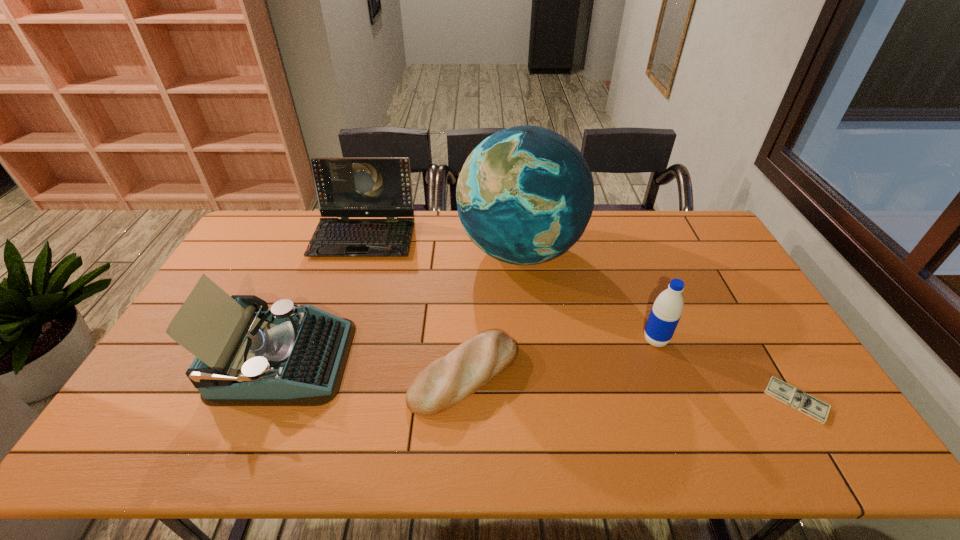
You are a GUI agent. You are given a task and a screenshot of the screen. Output one action in this format:
    pyautogui.click(x=<x>, y=<y>)
    Task: Click on the vacant space in between the laptop computer and the globe
    
    Given the screenshot: What is the action you would take?
    pyautogui.click(x=442, y=243)

Where is `free space that is in between the globe and the laptop computer`? free space that is in between the globe and the laptop computer is located at coordinates (442, 243).

In order to click on the fifth closest object to the dollar in this screenshot , I will do `click(346, 187)`.

Choose which object is the fifth nearest neighbor to the shortest object. Please provide its 2D coordinates. Your answer should be formatted as a tuple, i.e. [(x, y)], where the tuple contains the x and y coordinates of a point satisfying the conditions above.

[(346, 187)]

In order to click on vacant space that satisfies the following two spatial constraints: 1. on the back side of the tallest object; 2. on the left side of the bread in this screenshot , I will do `click(468, 251)`.

Locate an element on the screen. This screenshot has height=540, width=960. free spot that satisfies the following two spatial constraints: 1. on the front side of the tallest object; 2. on the typing side of the typewriter is located at coordinates (532, 360).

Find the location of `vacant area in the image that satisfies the following two spatial constraints: 1. on the typing side of the typewriter; 2. on the left side of the bread`. vacant area in the image that satisfies the following two spatial constraints: 1. on the typing side of the typewriter; 2. on the left side of the bread is located at coordinates (277, 374).

The width and height of the screenshot is (960, 540). I want to click on free space that satisfies the following two spatial constraints: 1. on the screen of the laptop computer; 2. on the right side of the fifth tallest object, so click(x=319, y=374).

At what (x,y) coordinates should I click in order to perform the action: click on free spot that satisfies the following two spatial constraints: 1. on the screen of the laptop computer; 2. on the typing side of the typewriter. Please return your answer as a coordinate pair (x, y). This screenshot has width=960, height=540. Looking at the image, I should click on (324, 360).

Where is `vacant space that satisfies the following two spatial constraints: 1. on the front side of the bread; 2. on the left side of the shortest object`? Image resolution: width=960 pixels, height=540 pixels. vacant space that satisfies the following two spatial constraints: 1. on the front side of the bread; 2. on the left side of the shortest object is located at coordinates (464, 400).